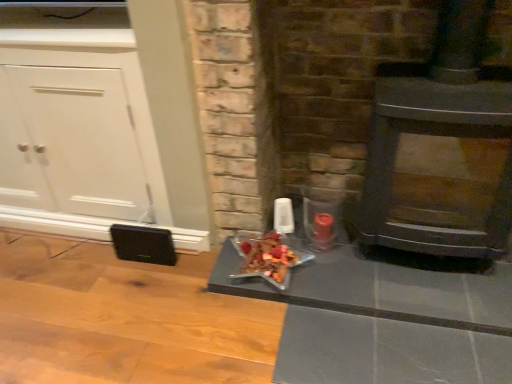
Find the location of a particular element. shiny glass tray at center is located at coordinates (384, 320).

The height and width of the screenshot is (384, 512). I want to click on wooden panel stove at right, so click(441, 136).

The image size is (512, 384). What do you see at coordinates (268, 257) in the screenshot?
I see `shiny metallic star at center` at bounding box center [268, 257].

This screenshot has width=512, height=384. Describe the element at coordinates (71, 134) in the screenshot. I see `white matte cabinet at left` at that location.

The image size is (512, 384). Identify the location of shiny glass tray at center. (384, 320).

Is white matte cabinet at left to the left of shiny glass tray at center from the viewer's perspective?

Yes, white matte cabinet at left is to the left of shiny glass tray at center.

Identify the location of cabinetry located on the left of shiny glass tray at center. (71, 134).

Considering the sizes of objects white matte cabinet at left and shiny glass tray at center in the image provided, who is shorter, white matte cabinet at left or shiny glass tray at center?

shiny glass tray at center.

Is shiny glass tray at center thinner than shiny metallic star at center?

No, shiny glass tray at center is not thinner than shiny metallic star at center.

Is the surface of shiny glass tray at center in direct contact with shiny metallic star at center?

shiny glass tray at center and shiny metallic star at center are not in contact.

Would you say shiny glass tray at center is outside shiny metallic star at center?

Yes, shiny glass tray at center is outside of shiny metallic star at center.

Based on the photo, is shiny glass tray at center turned away from shiny metallic star at center?

No, shiny glass tray at center is not facing away from shiny metallic star at center.

In terms of size, does shiny metallic star at center appear bigger or smaller than shiny glass tray at center?

In the image, shiny metallic star at center appears to be smaller than shiny glass tray at center.

Relative to shiny glass tray at center, is shiny metallic star at center in front or behind?

In the image, shiny metallic star at center appears behind shiny glass tray at center.

From the image's perspective, which is below, shiny metallic star at center or shiny glass tray at center?

shiny glass tray at center appears lower in the image.

Considering the positions of objects shiny metallic star at center and shiny glass tray at center in the image provided, who is more to the right, shiny metallic star at center or shiny glass tray at center?

Positioned to the right is shiny glass tray at center.

Considering the positions of objects wooden panel stove at right and shiny metallic star at center in the image provided, who is more to the right, wooden panel stove at right or shiny metallic star at center?

Positioned to the right is wooden panel stove at right.

Does point (445, 54) appear closer or farther from the camera than point (262, 253)?

Point (445, 54) is positioned closer to the camera compared to point (262, 253).

Between wooden panel stove at right and shiny metallic star at center, which one has smaller size?

shiny metallic star at center.

From a real-world perspective, is wooden panel stove at right physically located above or below shiny metallic star at center?

In terms of real-world spatial position, wooden panel stove at right is above shiny metallic star at center.

Is point (413, 233) positioned before point (59, 71)?

No, (413, 233) is further to viewer.

Considering the sizes of objects wooden panel stove at right and white matte cabinet at left in the image provided, who is shorter, wooden panel stove at right or white matte cabinet at left?

white matte cabinet at left is shorter.

Are wooden panel stove at right and white matte cabinet at left located far from each other?

Absolutely, wooden panel stove at right is distant from white matte cabinet at left.

The image size is (512, 384). Find the location of `cabinetry above the wooden panel stove at right (from the image's perspective)`. cabinetry above the wooden panel stove at right (from the image's perspective) is located at coordinates (71, 134).

From a real-world perspective, is shiny metallic star at center physically located above or below wooden panel stove at right?

Clearly, from a real-world perspective, shiny metallic star at center is below wooden panel stove at right.

Which is nearer, [260,250] or [445,0]?

The point [445,0] is in front.

Considering the sizes of shiny metallic star at center and wooden panel stove at right in the image, is shiny metallic star at center taller or shorter than wooden panel stove at right?

In the image, shiny metallic star at center appears to be shorter than wooden panel stove at right.

Considering the sizes of objects shiny metallic star at center and wooden panel stove at right in the image provided, who is smaller, shiny metallic star at center or wooden panel stove at right?

Smaller between the two is shiny metallic star at center.

Does white matte cabinet at left have a lesser height compared to matte black fireplace at center?

Yes.

From the image's perspective, which is above, white matte cabinet at left or matte black fireplace at center?

white matte cabinet at left appears higher in the image.

Identify the location of cabinetry below the matte black fireplace at center (from a real-world perspective). The height and width of the screenshot is (384, 512). (71, 134).

Which object is positioned more to the left, white matte cabinet at left or matte black fireplace at center?

Positioned to the left is white matte cabinet at left.

Image resolution: width=512 pixels, height=384 pixels. In order to click on cabinetry above the shiny glass tray at center (from a real-world perspective) in this screenshot , I will do `click(71, 134)`.

The width and height of the screenshot is (512, 384). What are the coordinates of `table below the shiny metallic star at center (from a real-world perspective)` in the screenshot? It's located at (384, 320).

Estimate the real-world distances between objects in this image. Which object is further from shiny glass tray at center, shiny metallic star at center or white matte cabinet at left?

white matte cabinet at left lies further to shiny glass tray at center than the other object.

Looking at the image, which one is located closer to matte black fireplace at center, shiny metallic star at center or white matte cabinet at left?

shiny metallic star at center.

Estimate the real-world distances between objects in this image. Which object is further from shiny metallic star at center, matte black fireplace at center or white matte cabinet at left?

white matte cabinet at left is further to shiny metallic star at center.

When comparing their distances from white matte cabinet at left, does matte black fireplace at center or shiny glass tray at center seem further?

Among the two, shiny glass tray at center is located further to white matte cabinet at left.

Based on their spatial positions, is wooden panel stove at right or shiny glass tray at center closer to shiny metallic star at center?

shiny glass tray at center.

From the image, which object appears to be farther from matte black fireplace at center, shiny glass tray at center or shiny metallic star at center?

shiny metallic star at center lies further to matte black fireplace at center than the other object.

From the image, which object appears to be farther from matte black fireplace at center, shiny glass tray at center or wooden panel stove at right?

wooden panel stove at right.

From the image, which object appears to be nearer to white matte cabinet at left, wooden panel stove at right or matte black fireplace at center?

Among the two, matte black fireplace at center is located nearer to white matte cabinet at left.

The height and width of the screenshot is (384, 512). What are the coordinates of `food between white matte cabinet at left and wooden panel stove at right from left to right` in the screenshot? It's located at (268, 257).

Where is `table situated between shiny metallic star at center and wooden panel stove at right from left to right`? table situated between shiny metallic star at center and wooden panel stove at right from left to right is located at coordinates (384, 320).

What are the coordinates of `wood burning stove located between matte black fireplace at center and shiny metallic star at center in the depth direction` in the screenshot? It's located at (441, 136).

Locate an element on the screen. This screenshot has height=384, width=512. fireplace between white matte cabinet at left and wooden panel stove at right from left to right is located at coordinates (344, 196).